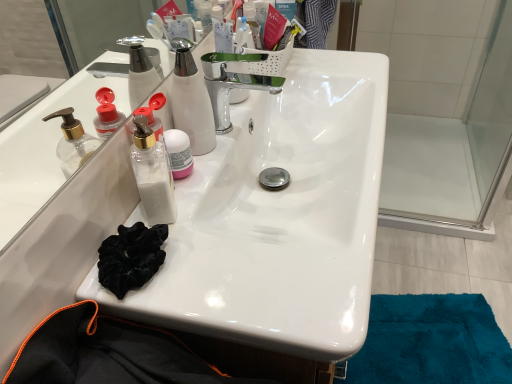
Question: Does white matte jar at center, the 1th bottle when ordered from right to left, have a greater width compared to transparent plastic pump bottle at center, the first bottle positioned from the left?

Choices:
 (A) no
 (B) yes

Answer: (A)

Question: Is white matte jar at center, the 1th bottle when ordered from right to left, next to transparent plastic pump bottle at center, positioned as the 2th bottle in right-to-left order?

Choices:
 (A) no
 (B) yes

Answer: (B)

Question: Can you confirm if white matte jar at center, the 1th bottle when ordered from right to left, is thinner than transparent plastic pump bottle at center, positioned as the 2th bottle in right-to-left order?

Choices:
 (A) no
 (B) yes

Answer: (B)

Question: Is transparent plastic pump bottle at center, positioned as the 2th bottle in right-to-left order, at the back of white matte jar at center, the 1th bottle when ordered from right to left?

Choices:
 (A) yes
 (B) no

Answer: (B)

Question: Can you confirm if white matte jar at center, the 1th bottle when ordered from right to left, is positioned to the left of transparent plastic pump bottle at center, positioned as the 2th bottle in right-to-left order?

Choices:
 (A) yes
 (B) no

Answer: (B)

Question: From the image's perspective, does white matte jar at center, the 1th bottle when ordered from right to left, appear higher than transparent plastic pump bottle at center, the first bottle positioned from the left?

Choices:
 (A) yes
 (B) no

Answer: (A)

Question: Could white matte jar at center, the 1th bottle when ordered from right to left, be considered to be inside transparent plastic pump bottle at center, positioned as the 2th bottle in right-to-left order?

Choices:
 (A) yes
 (B) no

Answer: (B)

Question: From the image's perspective, does transparent plastic pump bottle at center, positioned as the 2th bottle in right-to-left order, appear lower than white matte jar at center, which is the 2th bottle in left-to-right order?

Choices:
 (A) no
 (B) yes

Answer: (B)

Question: Considering the relative sizes of transparent plastic pump bottle at center, the first bottle positioned from the left, and white matte jar at center, the 1th bottle when ordered from right to left, in the image provided, is transparent plastic pump bottle at center, the first bottle positioned from the left, bigger than white matte jar at center, the 1th bottle when ordered from right to left,?

Choices:
 (A) no
 (B) yes

Answer: (B)

Question: Can you confirm if transparent plastic pump bottle at center, positioned as the 2th bottle in right-to-left order, is smaller than white matte jar at center, which is the 2th bottle in left-to-right order?

Choices:
 (A) no
 (B) yes

Answer: (A)

Question: Could you tell me if transparent plastic pump bottle at center, positioned as the 2th bottle in right-to-left order, is turned towards white matte jar at center, the 1th bottle when ordered from right to left?

Choices:
 (A) yes
 (B) no

Answer: (B)

Question: From a real-world perspective, does transparent plastic pump bottle at center, the first bottle positioned from the left, stand above white matte jar at center, which is the 2th bottle in left-to-right order?

Choices:
 (A) no
 (B) yes

Answer: (B)

Question: From the image's perspective, is transparent plastic pump bottle at center, positioned as the 2th bottle in right-to-left order, above or below white matte jar at center, which is the 2th bottle in left-to-right order?

Choices:
 (A) above
 (B) below

Answer: (B)